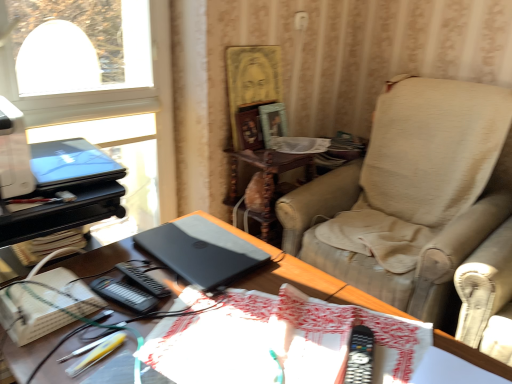
Find the location of a particular element. The height and width of the screenshot is (384, 512). free space above satin black laptop at center (from a real-world perspective) is located at coordinates (208, 309).